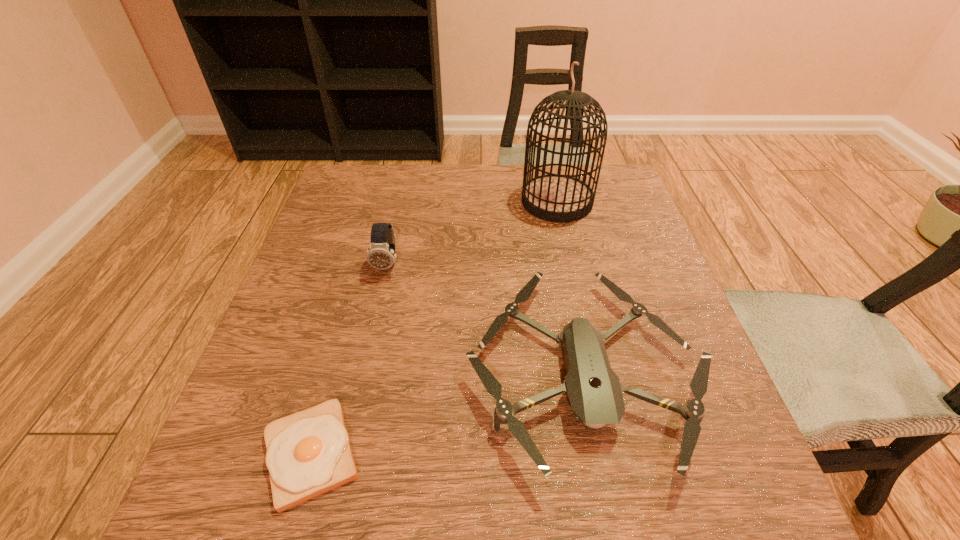
At what (x,y) coordinates should I click in order to perform the action: click on the farthest object. Please return your answer as a coordinate pair (x, y). This screenshot has width=960, height=540. Looking at the image, I should click on (559, 198).

Identify the location of birdcage. This screenshot has height=540, width=960. (559, 198).

Locate an element on the screen. watch is located at coordinates (381, 255).

Locate an element on the screen. the third nearest object is located at coordinates (381, 255).

I want to click on the third tallest object, so tap(594, 390).

This screenshot has height=540, width=960. Identify the location of toast. (308, 453).

Find the location of `vacant space situated 0.290m on the left of the farthest object`. vacant space situated 0.290m on the left of the farthest object is located at coordinates (413, 201).

Where is `free space located on the face of the third nearest object`? free space located on the face of the third nearest object is located at coordinates (347, 448).

Locate an element on the screen. vacant region located on the back of the shortest object is located at coordinates (337, 364).

I want to click on object present at the far edge, so click(559, 198).